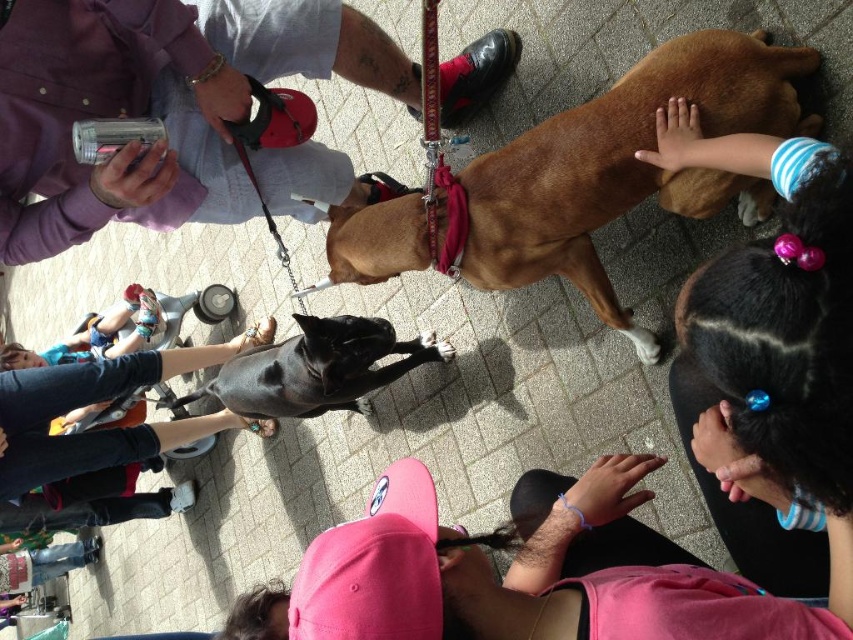
Question: Which is nearer to the dark brown hair at upper right?

Choices:
 (A) black leather pants at lower left
 (B) brown leather dog at center

Answer: (B)

Question: Which object is closer to the camera taking this photo?

Choices:
 (A) brown leather dog at center
 (B) matte black leash at upper center
 (C) black smooth dog at center
 (D) black leather pants at lower left

Answer: (A)

Question: Observing the image, what is the correct spatial positioning of dark brown hair at upper right in reference to black smooth dog at center?

Choices:
 (A) below
 (B) above

Answer: (B)

Question: Is brown leather dog at center to the right of black smooth dog at center from the viewer's perspective?

Choices:
 (A) no
 (B) yes

Answer: (B)

Question: In this image, where is pink fabric cap at lower center located relative to dark brown hair at upper right?

Choices:
 (A) left
 (B) right

Answer: (A)

Question: Which object is the farthest from the black smooth dog at center?

Choices:
 (A) black leather pants at lower left
 (B) pink fabric cap at lower center
 (C) matte black leash at upper center
 (D) dark brown hair at upper right

Answer: (D)